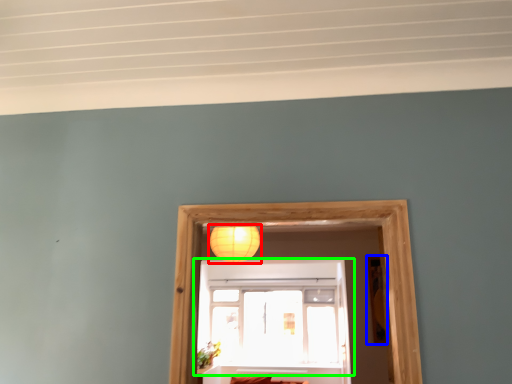
Question: Which is nearer to the lamp (highlighted by a red box)? picture frame (highlighted by a blue box) or window (highlighted by a green box).

Choices:
 (A) picture frame
 (B) window

Answer: (B)